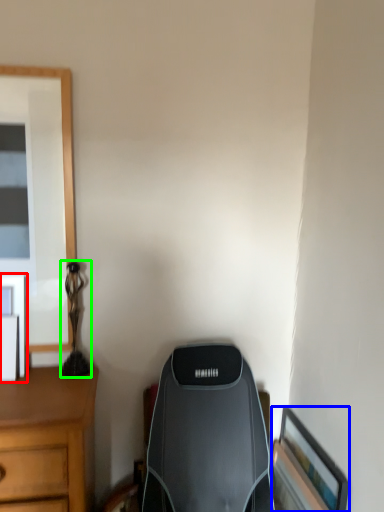
Question: Estimate the real-world distances between objects in this image. Which object is closer to picture frame (highlighted by a red box), picture frame (highlighted by a blue box) or table lamp (highlighted by a green box)?

Choices:
 (A) picture frame
 (B) table lamp

Answer: (B)